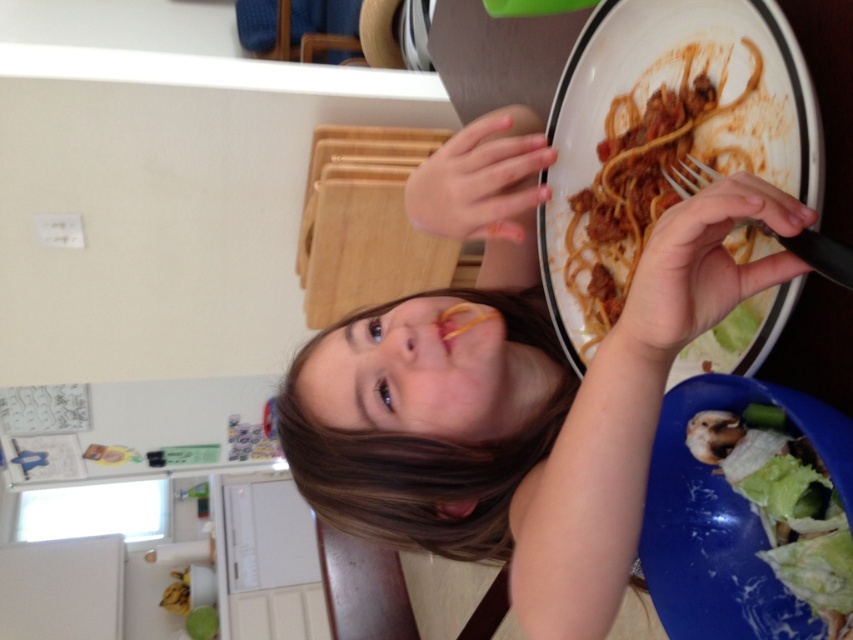
Question: Does brown matte spaghetti at center come behind green leafy vegetable at lower right?

Choices:
 (A) no
 (B) yes

Answer: (B)

Question: Can you confirm if smooth brown hair at center is thinner than brown matte spaghetti at center?

Choices:
 (A) yes
 (B) no

Answer: (B)

Question: Which point appears farthest from the camera in this image?

Choices:
 (A) (585, 342)
 (B) (355, 515)

Answer: (A)

Question: Considering the real-world distances, which object is closest to the brown matte spaghetti at center?

Choices:
 (A) black plastic fork at upper right
 (B) green leafy vegetable at lower right
 (C) smooth brown hair at center

Answer: (A)

Question: Which point is closer to the camera?

Choices:
 (A) (606, 404)
 (B) (846, 547)
 (C) (605, 179)
 (D) (802, 256)

Answer: (D)

Question: Does green leafy vegetable at lower right appear on the right side of black plastic fork at upper right?

Choices:
 (A) yes
 (B) no

Answer: (A)